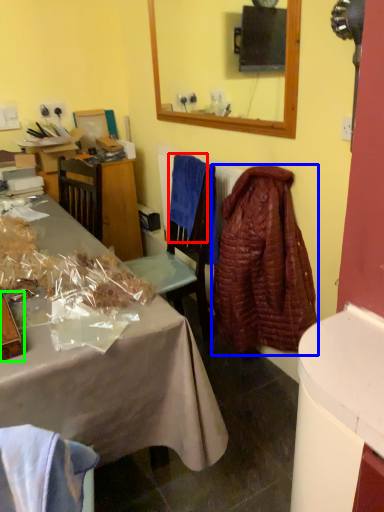
Question: Considering the real-world distances, which object is closest to cloth (highlighted by a red box)? robe (highlighted by a blue box) or box (highlighted by a green box).

Choices:
 (A) robe
 (B) box

Answer: (A)